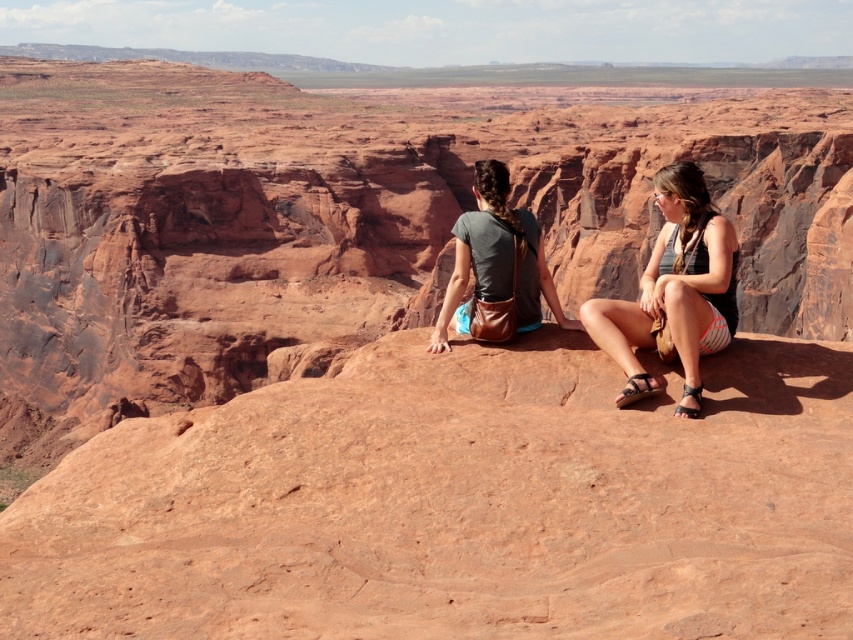
Does striped shorts at center come in front of matte brown purse at center?

Yes, striped shorts at center is in front of matte brown purse at center.

Is striped shorts at center below matte brown purse at center?

Yes, striped shorts at center is below matte brown purse at center.

At what (x,y) coordinates should I click in order to perform the action: click on striped shorts at center. Please return your answer as a coordinate pair (x, y). The image size is (853, 640). Looking at the image, I should click on (674, 292).

This screenshot has height=640, width=853. In order to click on striped shorts at center in this screenshot , I will do `click(674, 292)`.